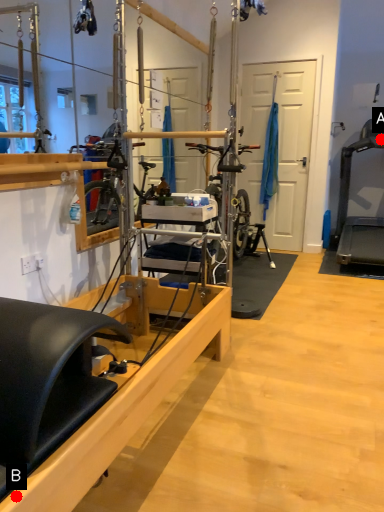
Question: Two points are circled on the image, labeled by A and B beside each circle. Which of the following is the closest to the observer?

Choices:
 (A) A is closer
 (B) B is closer

Answer: (B)